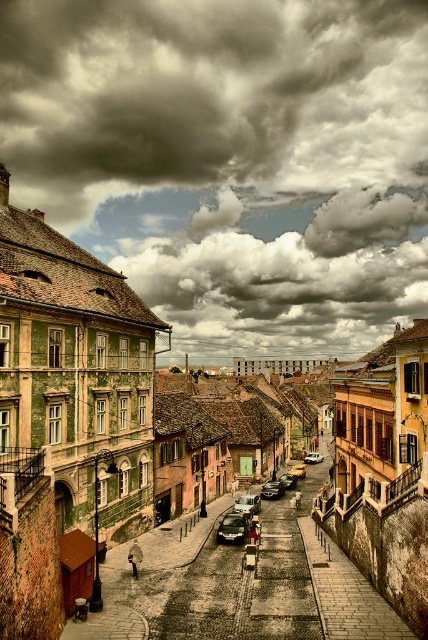
You are standing at the point with coordinates point (x=314, y=461) and want to walk to the point with coordinates point (x=255, y=504). Which direction should you face to walk towards your destination?

You should face towards the lower right direction to walk towards point (x=255, y=504) from point (x=314, y=461) because point (x=255, y=504) is in front of point (x=314, y=461).

From the picture: You are standing at the point marked as point (240, 584) in the historic European town. Which surface are you currently standing on?

You are standing on the matte stone alley at center.

You are a tour guide leading a group through the historic town. You notice the matte stone alley at center and the shiny black car at center. How far apart are these two landmarks from each other?

The matte stone alley at center is 26.61 feet from the shiny black car at center.